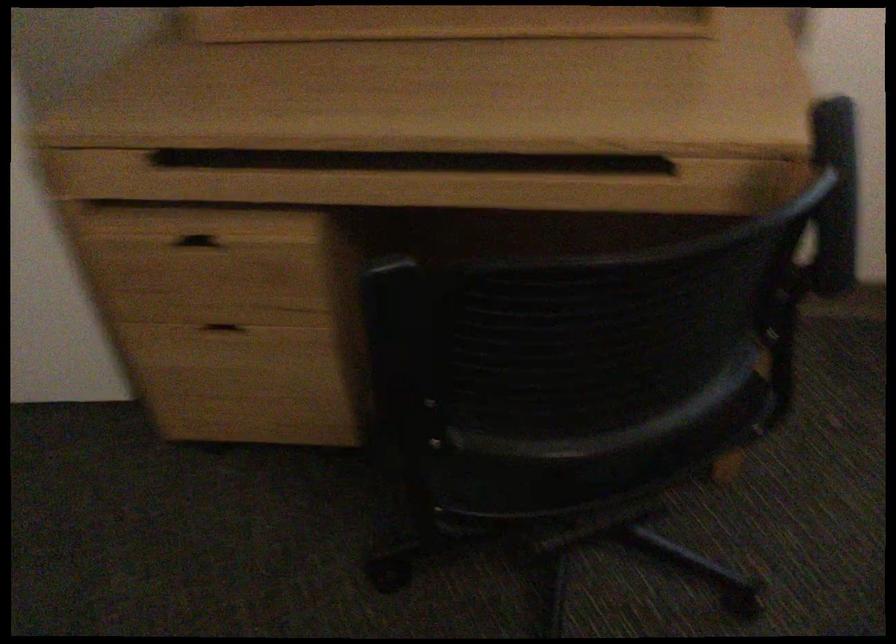
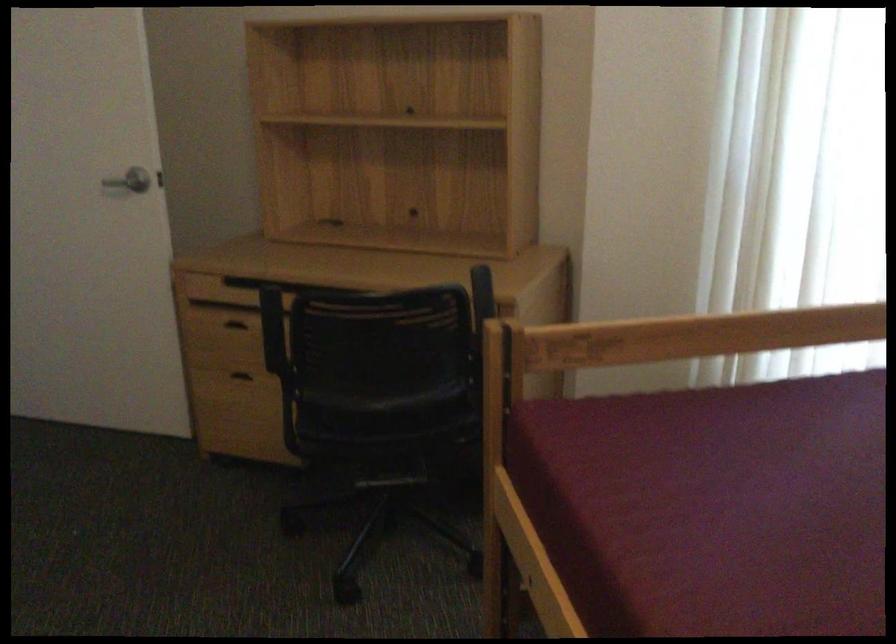
The point at (237, 328) is marked in the first image. Where is the corresponding point in the second image?

(246, 374)